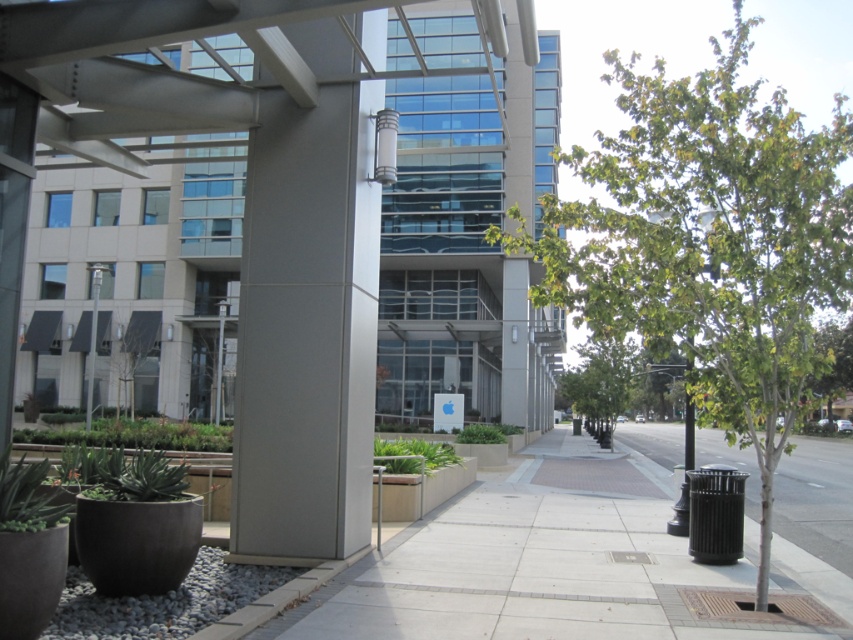
Which of these two, green leafy tree at center or green matte planter at center, stands taller?

green leafy tree at center is taller.

Can you confirm if green leafy tree at center is smaller than green matte planter at center?

No.

The image size is (853, 640). I want to click on green leafy tree at center, so click(x=711, y=243).

Where is `green matte planter at lower left`? This screenshot has height=640, width=853. green matte planter at lower left is located at coordinates (136, 435).

Who is more distant from viewer, (161, 428) or (408, 465)?

Point (161, 428)

The image size is (853, 640). In order to click on green matte planter at lower left in this screenshot , I will do `click(136, 435)`.

Is green leafy tree at center bigger than green matte planter at lower left?

Yes.

Image resolution: width=853 pixels, height=640 pixels. I want to click on green leafy tree at center, so coord(711,243).